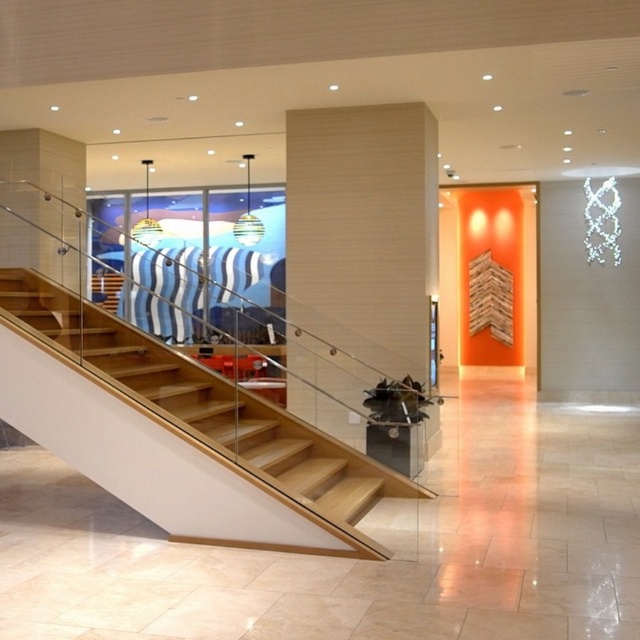
Measure the distance between wooden pillar at center and camera.

wooden pillar at center and camera are 28.51 feet apart.

Is wooden pillar at center bigger than wooden stairs at center?

Incorrect, wooden pillar at center is not larger than wooden stairs at center.

Identify the location of wooden pillar at center. Image resolution: width=640 pixels, height=640 pixels. (364, 230).